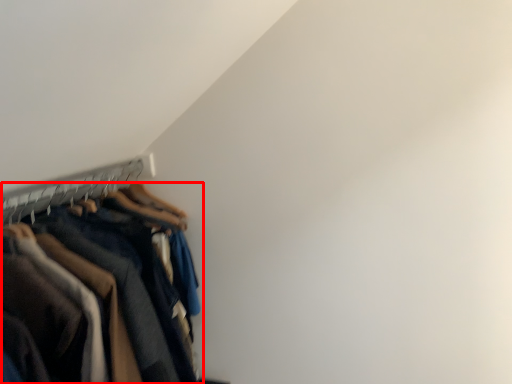
Question: Observing the image, what is the correct spatial positioning of trousers (annotated by the red box) in reference to hanger?

Choices:
 (A) right
 (B) left

Answer: (A)